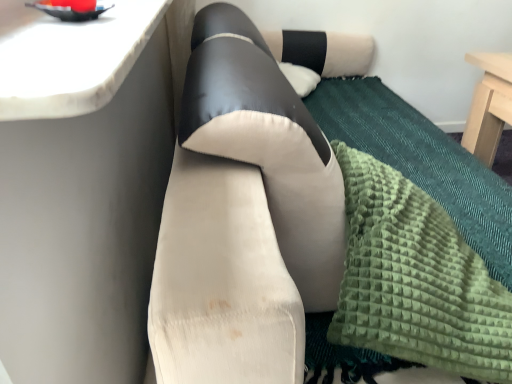
The height and width of the screenshot is (384, 512). Identify the location of suede-like beige couch at center. [221, 281].

Locate an element on the screen. This screenshot has width=512, height=384. white marble countertop at upper left is located at coordinates (70, 58).

What are the coordinates of `suede-like beige couch at center` in the screenshot? It's located at (221, 281).

Does green textured blanket at lower right have a larger size compared to suede-like beige couch at center?

Actually, green textured blanket at lower right might be smaller than suede-like beige couch at center.

Is green textured blanket at lower right facing away from suede-like beige couch at center?

Yes.

From a real-world perspective, which is physically above, green textured blanket at lower right or suede-like beige couch at center?

From a 3D spatial view, green textured blanket at lower right is above.

Can you tell me how much green textured blanket at lower right and suede-like beige couch at center differ in facing direction?

0.000695 degrees.

From the image's perspective, would you say green textured blanket at lower right is positioned over white marble countertop at upper left?

No, from the image's perspective, green textured blanket at lower right is not above white marble countertop at upper left.

Which is in front, green textured blanket at lower right or white marble countertop at upper left?

Positioned in front is white marble countertop at upper left.

Is green textured blanket at lower right positioned with its back to white marble countertop at upper left?

green textured blanket at lower right does not have its back to white marble countertop at upper left.

From a real-world perspective, is suede-like beige couch at center physically above green textured blanket at lower right?

Incorrect, from a real-world perspective, suede-like beige couch at center is lower than green textured blanket at lower right.

Is suede-like beige couch at center inside or outside of green textured blanket at lower right?

suede-like beige couch at center exists outside the volume of green textured blanket at lower right.

Considering the relative positions of suede-like beige couch at center and green textured blanket at lower right in the image provided, is suede-like beige couch at center to the left of green textured blanket at lower right from the viewer's perspective?

Indeed, suede-like beige couch at center is positioned on the left side of green textured blanket at lower right.

From their relative heights in the image, would you say suede-like beige couch at center is taller or shorter than green textured blanket at lower right?

Clearly, suede-like beige couch at center is taller compared to green textured blanket at lower right.

This screenshot has height=384, width=512. Identify the location of counter top on the left of suede-like beige couch at center. (70, 58).

Considering the sizes of objects suede-like beige couch at center and white marble countertop at upper left in the image provided, who is taller, suede-like beige couch at center or white marble countertop at upper left?

suede-like beige couch at center.

Considering their positions, is suede-like beige couch at center located in front of or behind white marble countertop at upper left?

Visually, suede-like beige couch at center is located behind white marble countertop at upper left.

From the image's perspective, is suede-like beige couch at center located above or below white marble countertop at upper left?

suede-like beige couch at center is below white marble countertop at upper left.

Based on their positions, is white marble countertop at upper left located to the left or right of suede-like beige couch at center?

Clearly, white marble countertop at upper left is on the left of suede-like beige couch at center in the image.

Which is farther from the camera, (130, 38) or (221, 335)?

Positioned behind is point (130, 38).

Looking at this image, can you confirm if white marble countertop at upper left is smaller than suede-like beige couch at center?

Yes.

Considering the sizes of objects white marble countertop at upper left and suede-like beige couch at center in the image provided, who is thinner, white marble countertop at upper left or suede-like beige couch at center?

With smaller width is white marble countertop at upper left.

From a real-world perspective, is white marble countertop at upper left over green textured blanket at lower right?

Indeed, from a real-world perspective, white marble countertop at upper left stands above green textured blanket at lower right.

Is the position of white marble countertop at upper left more distant than that of green textured blanket at lower right?

That is False.

Find the location of `counter top that appears above the green textured blanket at lower right (from the image's perspective)`. counter top that appears above the green textured blanket at lower right (from the image's perspective) is located at coordinates (70, 58).

You are a GUI agent. You are given a task and a screenshot of the screen. Output one action in this format:
    pyautogui.click(x=<x>, y=<y>)
    Task: Click on the blanket positioned vertically above the suede-like beige couch at center (from a real-world perspective)
    The width and height of the screenshot is (512, 384).
    Given the screenshot: What is the action you would take?
    pyautogui.click(x=415, y=279)

Find the location of a particular element. counter top lying on the left of green textured blanket at lower right is located at coordinates pos(70,58).

When comparing their distances from white marble countertop at upper left, does suede-like beige couch at center or green textured blanket at lower right seem further?

green textured blanket at lower right is positioned further to the anchor white marble countertop at upper left.

Based on their spatial positions, is white marble countertop at upper left or green textured blanket at lower right closer to suede-like beige couch at center?

Based on the image, green textured blanket at lower right appears to be nearer to suede-like beige couch at center.

When comparing their distances from green textured blanket at lower right, does suede-like beige couch at center or white marble countertop at upper left seem further?

The object further to green textured blanket at lower right is white marble countertop at upper left.

Looking at this image, considering their positions, is white marble countertop at upper left positioned further to green textured blanket at lower right than suede-like beige couch at center?

Among the two, white marble countertop at upper left is located further to green textured blanket at lower right.

When comparing their distances from suede-like beige couch at center, does green textured blanket at lower right or white marble countertop at upper left seem further?

Based on the image, white marble countertop at upper left appears to be further to suede-like beige couch at center.

Based on their spatial positions, is green textured blanket at lower right or suede-like beige couch at center closer to white marble countertop at upper left?

The object closer to white marble countertop at upper left is suede-like beige couch at center.

Locate an element on the screen. Image resolution: width=512 pixels, height=384 pixels. studio couch situated between white marble countertop at upper left and green textured blanket at lower right from left to right is located at coordinates (221, 281).